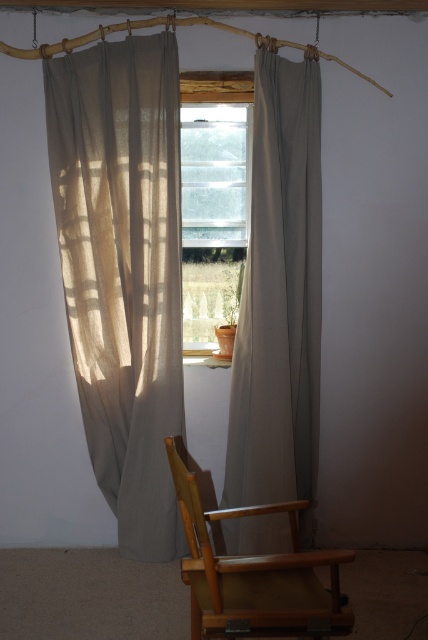
Question: Which point is closer to the camera taking this photo?

Choices:
 (A) (158, 536)
 (B) (296, 630)
 (C) (243, 189)
 (D) (278, 353)

Answer: (B)

Question: Among these objects, which one is nearest to the camera?

Choices:
 (A) sheer fabric curtain at center
 (B) clear glass window at center

Answer: (A)

Question: Can you confirm if sheer fabric curtain at center is thinner than clear glass window at center?

Choices:
 (A) yes
 (B) no

Answer: (B)

Question: Is sheer beige curtain at left behind clear glass window at center?

Choices:
 (A) no
 (B) yes

Answer: (A)

Question: Which point appears closest to the camera in this image?

Choices:
 (A) (125, 432)
 (B) (184, 150)
 (C) (272, 369)

Answer: (C)

Question: Does light brown wooden armchair at lower center appear on the right side of clear glass window at center?

Choices:
 (A) no
 (B) yes

Answer: (B)